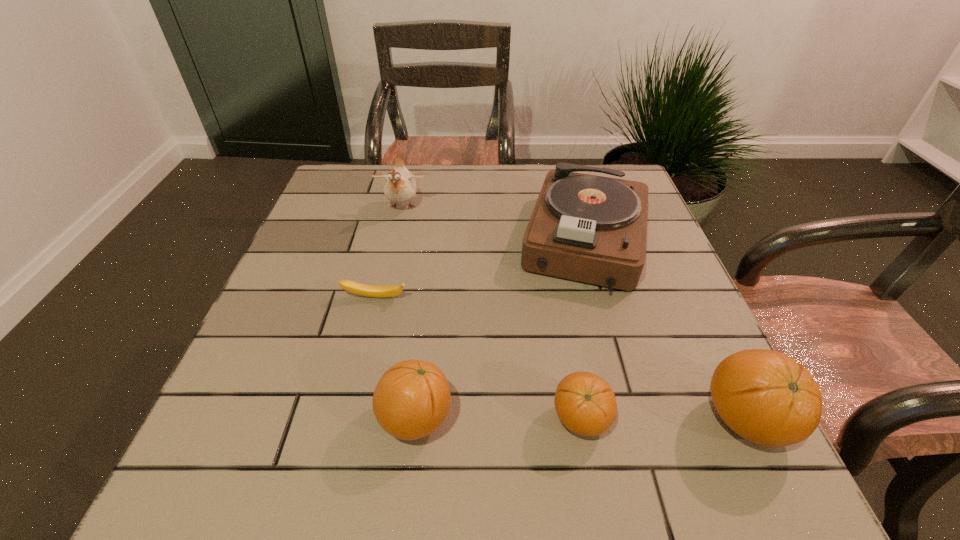
In the current image, all oranges are evenly spaced. To maintain this equal spacing, where should an additional orange be placed on the left? Please point out a free spot. Please provide its 2D coordinates. Your answer should be formatted as a tuple, i.e. [(x, y)], where the tuple contains the x and y coordinates of a point satisfying the conditions above.

[(252, 418)]